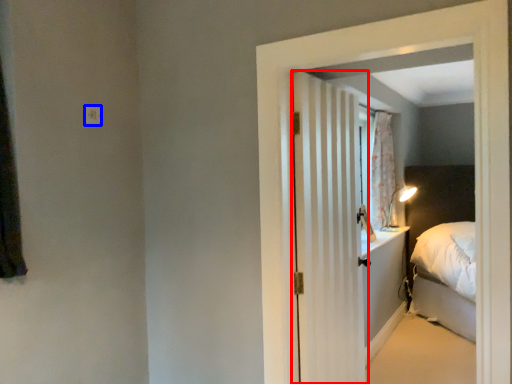
Question: Which of the following is the farthest to the observer, door (highlighted by a red box) or electric outlet (highlighted by a blue box)?

Choices:
 (A) door
 (B) electric outlet

Answer: (B)